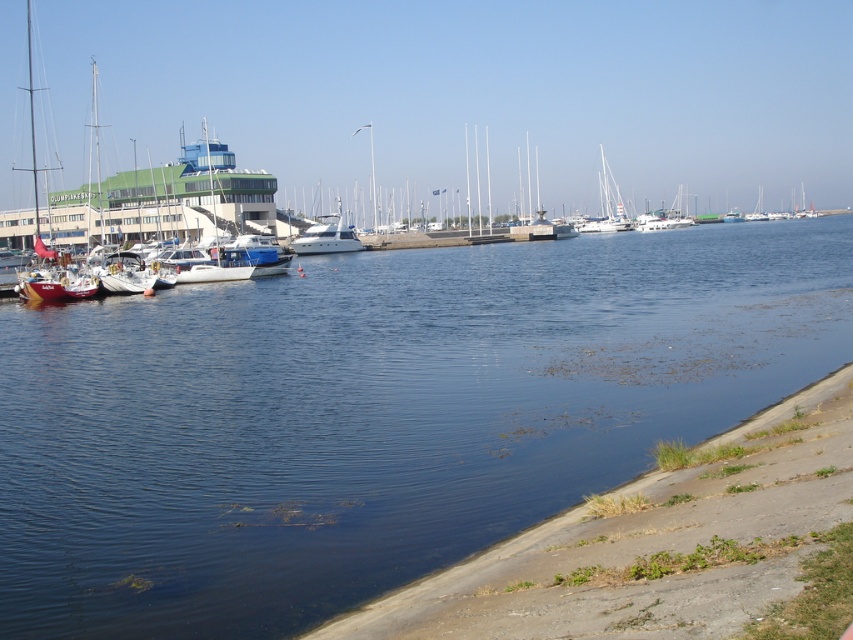
You are standing at the embankment in the marina scene. You notice two points marked in the image. Which point, point (161, 429) or point (606, 216), is closer to your current position?

Point (161, 429) is closer to the camera than point (606, 216), so it is closer to your current position at the embankment.